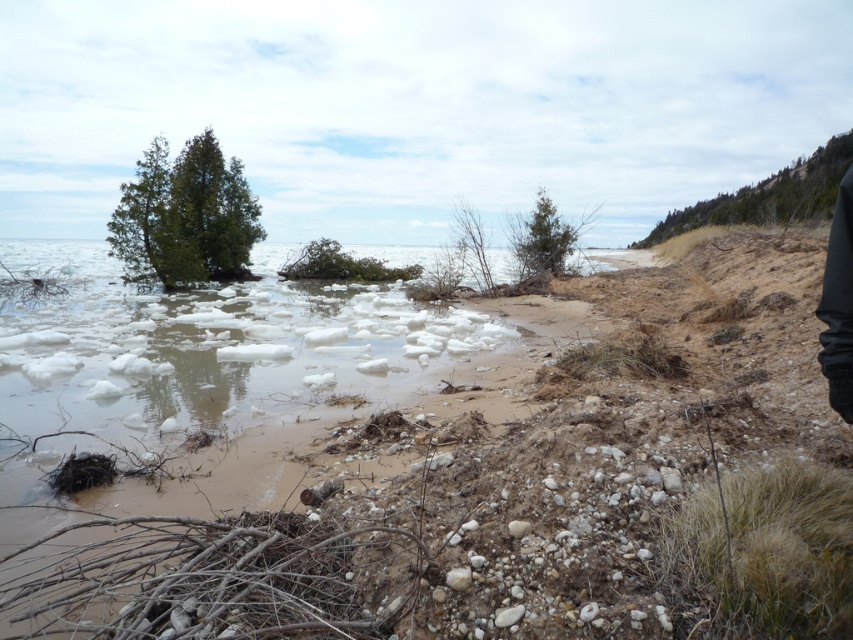
You are standing at point A located at coordinates point A at (160, 172). You want to walk to point B located at coordinates point B at 0.356, 0.291. The path between them is a narrow wooden walkway that is 1.8 meters wide. Can you safely walk from point A to point B without stepping into the icy water?

The path between point A at (160, 172) and point B at 0.356, 0.291 is 22.23 meters apart. Since the walkway is 1.8 meters wide, which is sufficient for a person to walk safely, you can proceed without stepping into the icy water.